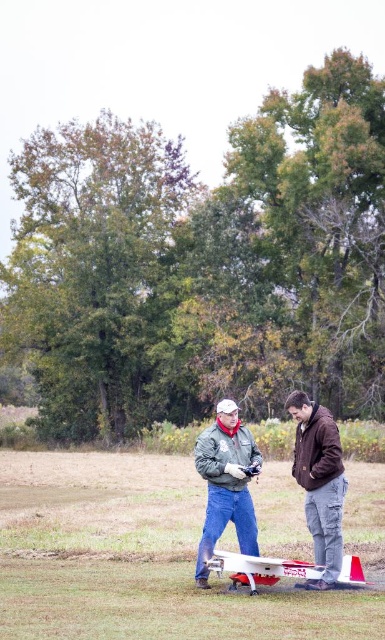
What do you see at coordinates (225, 484) in the screenshot? I see `gray matte jacket at center` at bounding box center [225, 484].

Is point (199, 577) positioned before point (259, 566)?

That is False.

I want to click on gray matte jacket at center, so click(x=225, y=484).

Can you confirm if gray matte jacket at center is smaller than brown matte jacket at center?

Yes, gray matte jacket at center is smaller than brown matte jacket at center.

Based on the photo, which of these two, gray matte jacket at center or brown matte jacket at center, stands shorter?

With less height is gray matte jacket at center.

What are the coordinates of `gray matte jacket at center` in the screenshot? It's located at (225, 484).

Can you confirm if matte gray jacket at center is taller than white matte airplane at center?

No.

What do you see at coordinates (319, 481) in the screenshot? This screenshot has width=385, height=640. I see `matte gray jacket at center` at bounding box center [319, 481].

Locate an element on the screen. Image resolution: width=385 pixels, height=640 pixels. matte gray jacket at center is located at coordinates (319, 481).